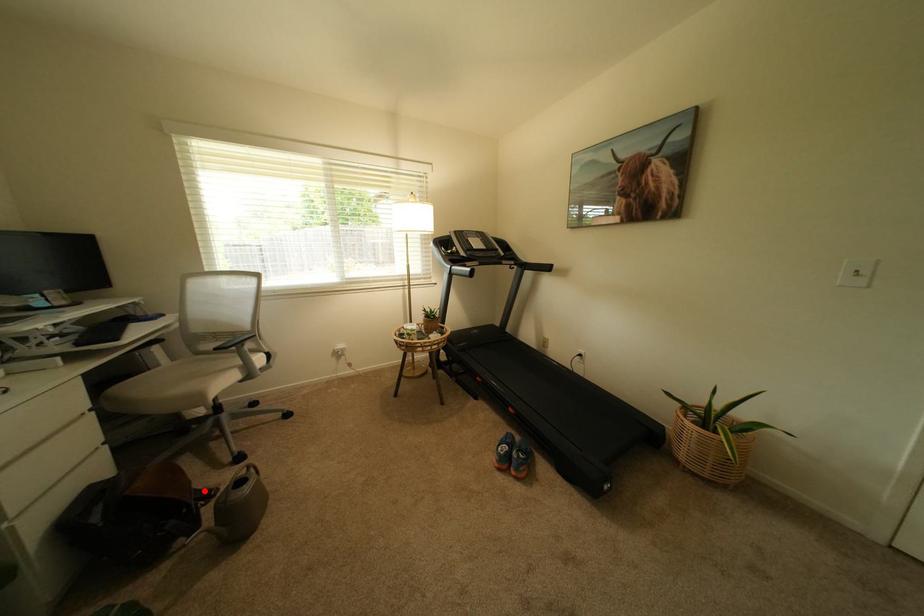
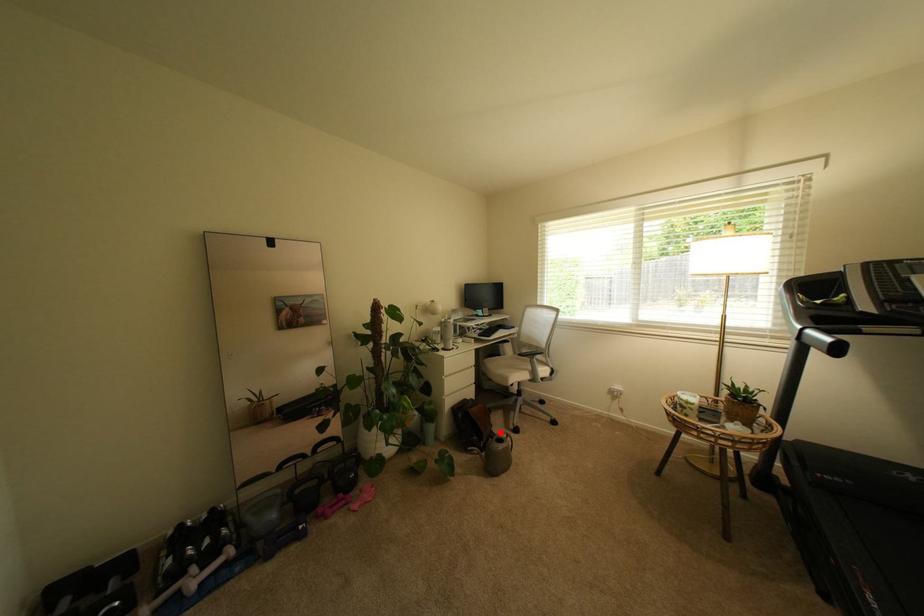
Consider the image. I am providing you with two images of the same scene from different viewpoints. A red point is marked on the first image and another point is marked on the second image. Is the red point in image1 aligned with the point shown in image2?

Yes